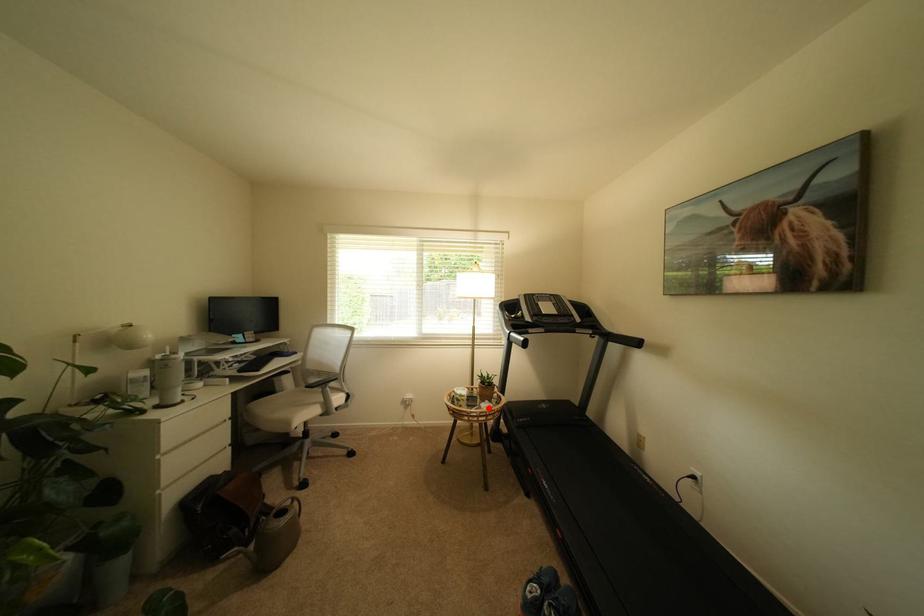
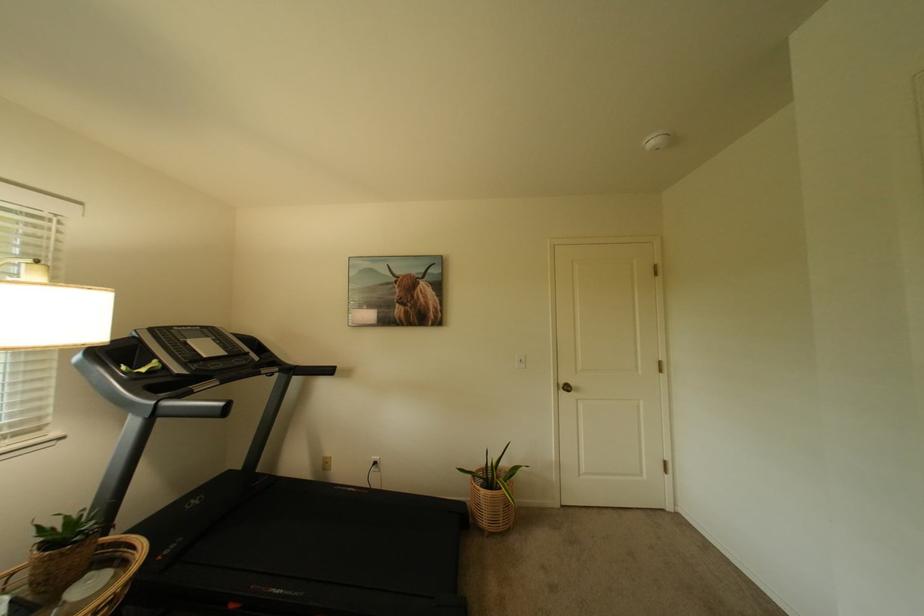
Question: I am providing you with two images of the same scene from different viewpoints. A red point is shown in image1. For the corresponding object point in image2, is it positioned nearer or farther from the camera?

Choices:
 (A) Nearer
 (B) Farther

Answer: (A)